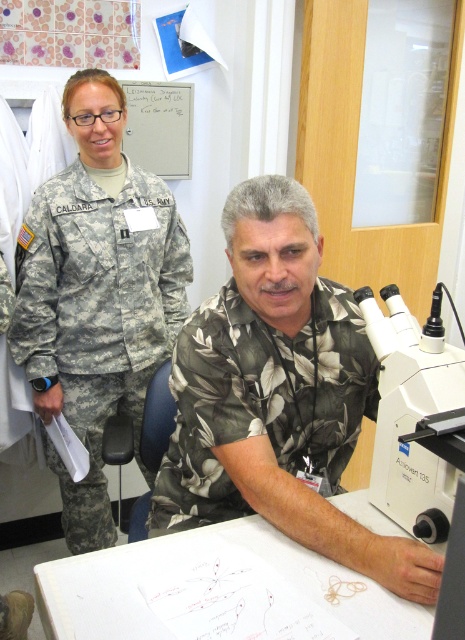
Is floral shirt at center shorter than green leafy fabric shirt at center?

No, floral shirt at center is not shorter than green leafy fabric shirt at center.

Can you confirm if floral shirt at center is smaller than green leafy fabric shirt at center?

No.

Is point (284, 275) farther from viewer compared to point (324, 308)?

No, it is in front of (324, 308).

At what (x,y) coordinates should I click in order to perform the action: click on floral shirt at center. Please return your answer as a coordinate pair (x, y). Looking at the image, I should click on (278, 396).

Between camouflage fabric uniform at left and green leafy fabric shirt at center, which one has less height?

green leafy fabric shirt at center is shorter.

Who is lower down, camouflage fabric uniform at left or green leafy fabric shirt at center?

green leafy fabric shirt at center is lower down.

Identify the location of camouflage fabric uniform at left. Image resolution: width=465 pixels, height=640 pixels. (98, 316).

The height and width of the screenshot is (640, 465). What are the coordinates of `camouflage fabric uniform at left` in the screenshot? It's located at (98, 316).

Which is more to the right, camouflage fabric uniform at left or white plastic microscope at right?

white plastic microscope at right is more to the right.

Can you confirm if camouflage fabric uniform at left is positioned to the right of white plastic microscope at right?

Incorrect, camouflage fabric uniform at left is not on the right side of white plastic microscope at right.

Is point (86, 228) farther from camera compared to point (432, 348)?

Yes.

Locate an element on the screen. camouflage fabric uniform at left is located at coordinates (98, 316).